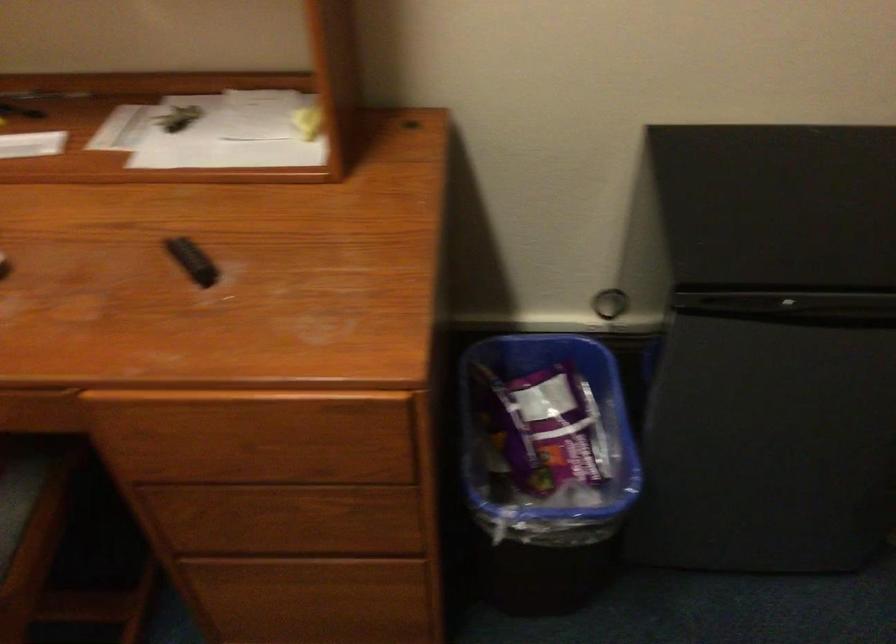
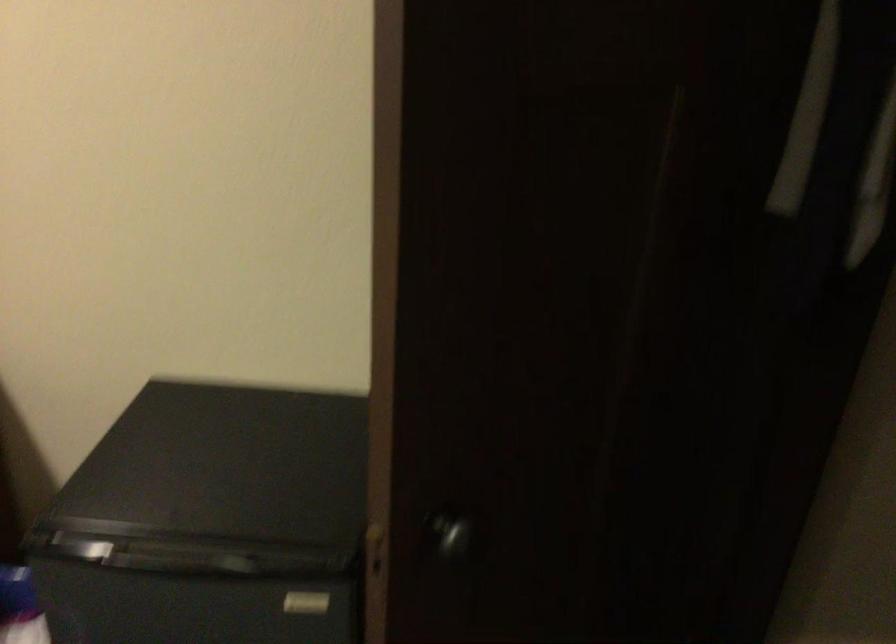
Question: In a continuous first-person perspective shot, in which direction is the camera moving?

Choices:
 (A) Left
 (B) Right
 (C) Forward
 (D) Backward

Answer: (B)